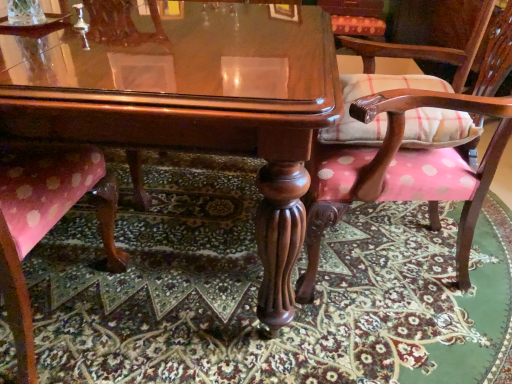
Question: From the image's perspective, is pink polka dot fabric chair at lower left, the 3th chair when ordered from right to left, above or below glossy wood table at center?

Choices:
 (A) above
 (B) below

Answer: (B)

Question: Is pink polka dot fabric chair at lower left, the 3th chair when ordered from right to left, wider or thinner than glossy wood table at center?

Choices:
 (A) wide
 (B) thin

Answer: (B)

Question: Based on their relative distances, which object is nearer to the plaid fabric cushion at upper right, the first chair when ordered from back to front?

Choices:
 (A) glossy wood table at center
 (B) pink polka dot fabric chair at lower left, the 3th chair when ordered from right to left
 (C) pink polka dot fabric at lower center
 (D) pink polka dot fabric chair at center, the 2th chair viewed from the back
 (E) plaid fabric pillow at right

Answer: (E)

Question: Considering the real-world distances, which object is closest to the glossy wood table at center?

Choices:
 (A) plaid fabric pillow at right
 (B) pink polka dot fabric chair at lower left, the 3th chair when ordered from right to left
 (C) plaid fabric cushion at upper right, the first chair when ordered from back to front
 (D) pink polka dot fabric chair at center, the 2th chair viewed from the back
 (E) pink polka dot fabric at lower center

Answer: (B)